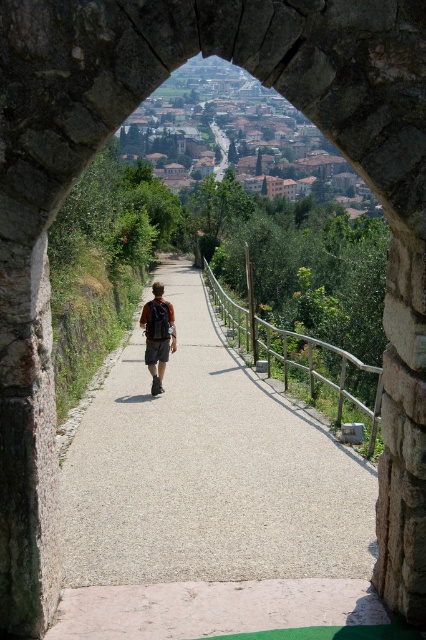
Which is above, light gray gravel path at center or matte black backpack at center?

matte black backpack at center is higher up.

Does light gray gravel path at center appear under matte black backpack at center?

Answer: Correct, light gray gravel path at center is located below matte black backpack at center.

This screenshot has height=640, width=426. In order to click on light gray gravel path at center in this screenshot , I will do `click(209, 468)`.

This screenshot has height=640, width=426. I want to click on light gray gravel path at center, so click(209, 468).

Does light gray gravel path at center have a lesser width compared to brown backpack at center?

No, light gray gravel path at center is not thinner than brown backpack at center.

Identify the location of light gray gravel path at center. (209, 468).

Is the position of brown backpack at center more distant than that of matte black backpack at center?

That is True.

Based on the photo, between brown backpack at center and matte black backpack at center, which one appears on the right side from the viewer's perspective?

brown backpack at center is more to the right.

At what (x,y) coordinates should I click in order to perform the action: click on brown backpack at center. Please return your answer as a coordinate pair (x, y). The image size is (426, 640). Looking at the image, I should click on (158, 333).